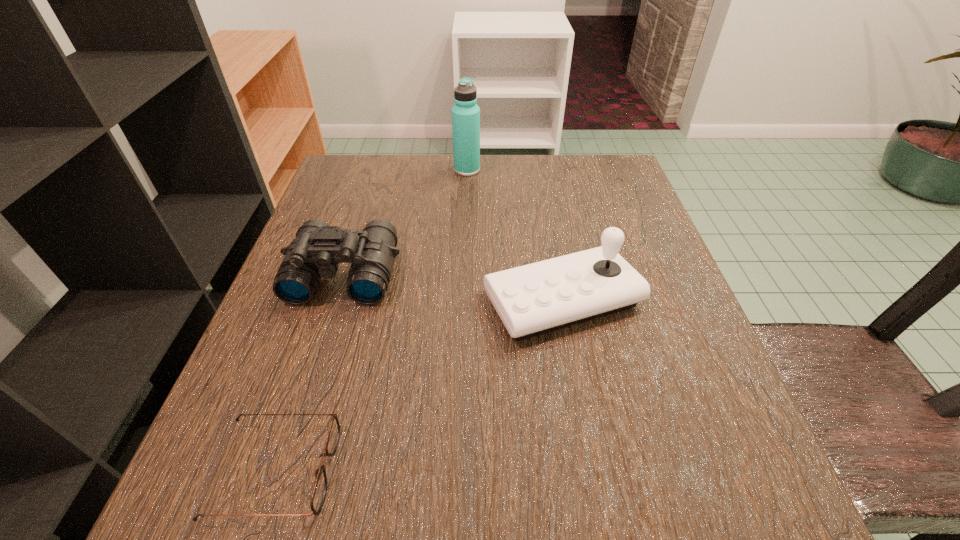
The image size is (960, 540). In order to click on object that is at the far edge in this screenshot , I will do `click(465, 113)`.

At what (x,y) coordinates should I click in order to perform the action: click on object at the near edge. Please return your answer as a coordinate pair (x, y). The image size is (960, 540). Looking at the image, I should click on (319, 492).

Locate an element on the screen. binoculars located at the left edge is located at coordinates pyautogui.click(x=318, y=248).

Where is `sunglasses located at the left edge`? The height and width of the screenshot is (540, 960). sunglasses located at the left edge is located at coordinates point(319,492).

I want to click on object situated at the right edge, so click(537, 298).

Where is `object that is at the near left corner`? object that is at the near left corner is located at coordinates (319, 492).

Where is `free region at the far edge of the desktop`? free region at the far edge of the desktop is located at coordinates (560, 206).

In the image, there is a desktop. Identify the location of free region at the near edge. (374, 473).

Locate an element on the screen. This screenshot has height=540, width=960. free location at the right edge is located at coordinates (599, 215).

Where is `vacant space at the far left corner of the desktop`? The image size is (960, 540). vacant space at the far left corner of the desktop is located at coordinates (384, 191).